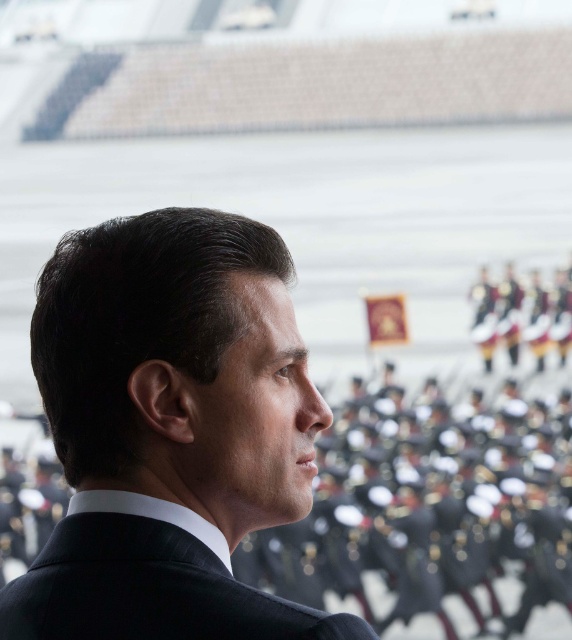
Question: Is black silk suit at center positioned behind black pinstripe suit at center?

Choices:
 (A) no
 (B) yes

Answer: (A)

Question: Which object appears closest to the camera in this image?

Choices:
 (A) black pinstripe suit at center
 (B) black silk suit at center

Answer: (B)

Question: Is black silk suit at center positioned in front of black pinstripe suit at center?

Choices:
 (A) yes
 (B) no

Answer: (A)

Question: Does black silk suit at center have a lesser width compared to black pinstripe suit at center?

Choices:
 (A) no
 (B) yes

Answer: (B)